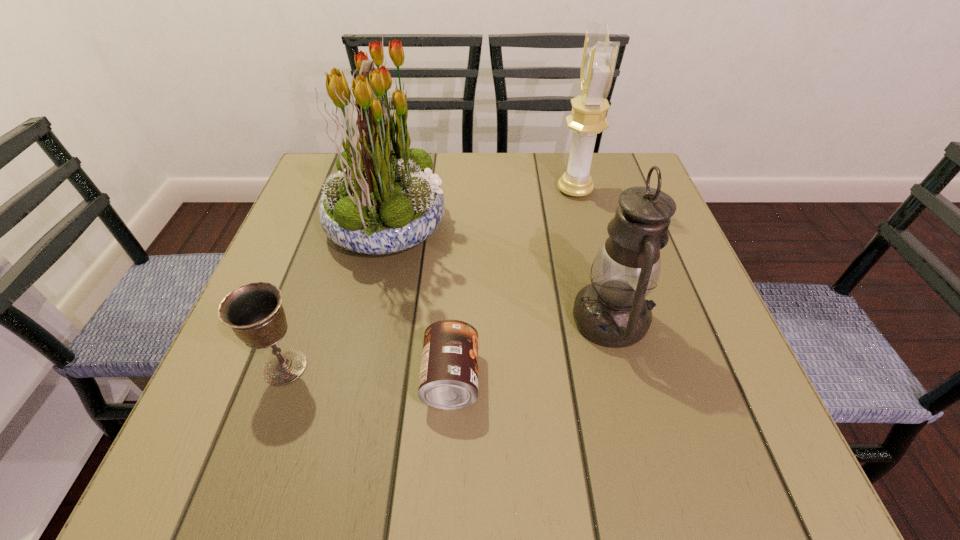
The width and height of the screenshot is (960, 540). I want to click on free point that satisfies the following two spatial constraints: 1. on the front-facing side of the oil lamp; 2. on the right side of the flower arrangement, so click(366, 320).

Find the location of `blank area in the image that satisfies the following two spatial constraints: 1. on the front-facing side of the flower arrangement; 2. on the right side of the oil lamp`. blank area in the image that satisfies the following two spatial constraints: 1. on the front-facing side of the flower arrangement; 2. on the right side of the oil lamp is located at coordinates (366, 320).